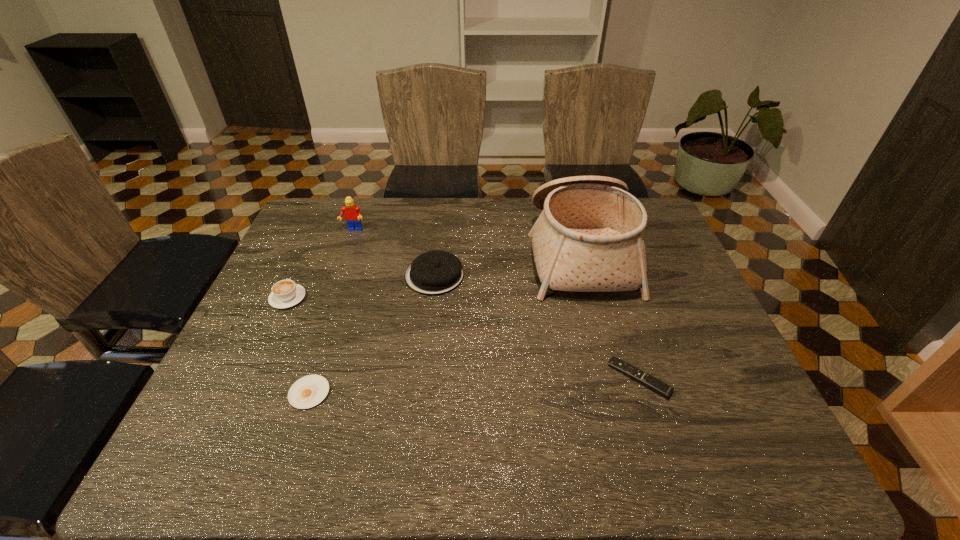
Locate an element on the screen. This screenshot has height=540, width=960. empty space between the third shortest object and the Lego is located at coordinates click(321, 264).

You are a GUI agent. You are given a task and a screenshot of the screen. Output one action in this format:
    pyautogui.click(x=<x>, y=<y>)
    Task: Click on the vacant area that lies between the fourth tallest object and the third object from right to left
    The image size is (960, 540).
    Given the screenshot: What is the action you would take?
    point(361,287)

Where is `empty space between the remote control and the leftmost object`? The image size is (960, 540). empty space between the remote control and the leftmost object is located at coordinates (464, 338).

This screenshot has width=960, height=540. Identify the location of vacant space that is in between the leftmost object and the third object from right to left. (361, 287).

This screenshot has height=540, width=960. Find the location of `vacant area between the second shortest object and the cappuccino`. vacant area between the second shortest object and the cappuccino is located at coordinates (464, 338).

I want to click on free spot between the third tallest object and the Lego, so click(394, 253).

This screenshot has width=960, height=540. Identify the location of free spot between the fifth tallest object and the shortest object. (474, 386).

The height and width of the screenshot is (540, 960). I want to click on vacant space that's between the fifth tallest object and the egg yolk, so click(474, 386).

Locate an element on the screen. empty space between the Lego and the remote control is located at coordinates (496, 304).

Where is `object that is the closest to the fourth object from left to right`? The height and width of the screenshot is (540, 960). object that is the closest to the fourth object from left to right is located at coordinates click(352, 212).